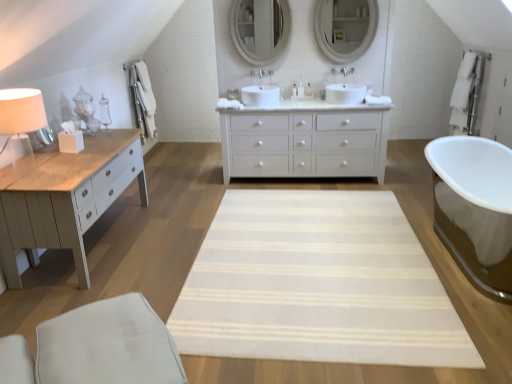
Image resolution: width=512 pixels, height=384 pixels. In order to click on free space to the left of white painted wood chest of drawers at center in this screenshot , I will do `click(187, 190)`.